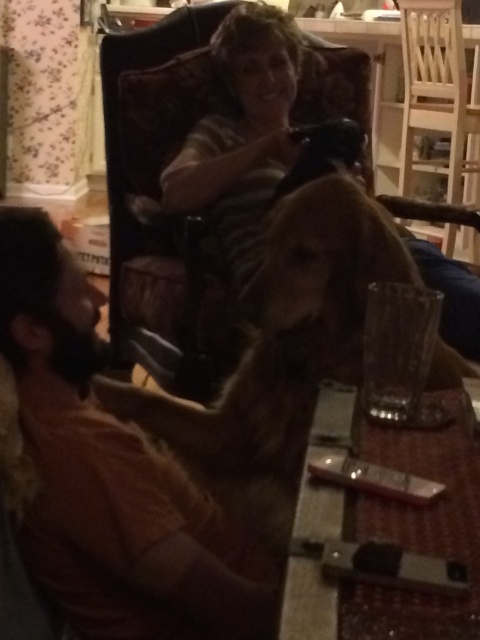
Does brown fuzzy sweater at left appear under metallic silver remote at center?

No, brown fuzzy sweater at left is not below metallic silver remote at center.

Is brown fuzzy sweater at left smaller than metallic silver remote at center?

No.

Between point (54, 301) and point (387, 496), which one is positioned behind?

Positioned behind is point (54, 301).

At what (x,y) coordinates should I click in order to perform the action: click on brown fuzzy sweater at left. Please return your answer as a coordinate pair (x, y). Looking at the image, I should click on (110, 476).

Is point (419, 48) in front of point (371, 492)?

That is False.

Describe the element at coordinates (437, 90) in the screenshot. The width and height of the screenshot is (480, 640). I see `wooden chair at upper right` at that location.

Does point (430, 56) come closer to viewer compared to point (325, 460)?

That is False.

Where is `wooden chair at upper right`? wooden chair at upper right is located at coordinates (437, 90).

Is brown fuzzy sweater at left above striped shirt at upper center?

Incorrect, brown fuzzy sweater at left is not positioned above striped shirt at upper center.

Can you confirm if brown fuzzy sweater at left is shorter than striped shirt at upper center?

Correct, brown fuzzy sweater at left is not as tall as striped shirt at upper center.

Is point (137, 572) positioned after point (233, 67)?

No.

Where is `brown fuzzy sweater at left`? The height and width of the screenshot is (640, 480). brown fuzzy sweater at left is located at coordinates click(x=110, y=476).